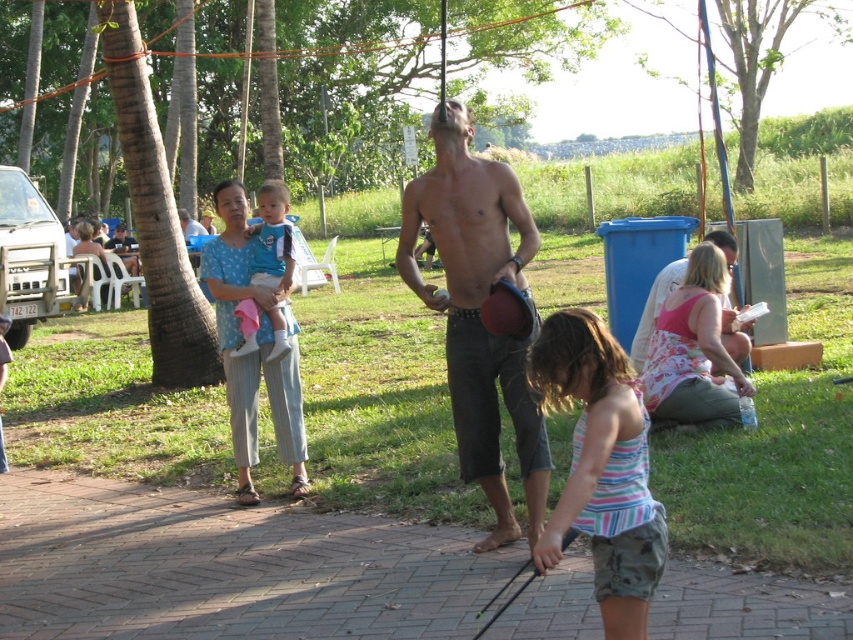
Between striped fabric dress at lower center and blue cotton shirt at center, which one is positioned lower?

striped fabric dress at lower center is below.

Between striped fabric dress at lower center and blue cotton shirt at center, which one has less height?

With less height is blue cotton shirt at center.

Measure the distance between point (x=613, y=349) and camera.

Point (x=613, y=349) and camera are 11.98 feet apart from each other.

You are a GUI agent. You are given a task and a screenshot of the screen. Output one action in this format:
    pyautogui.click(x=<x>, y=<y>)
    Task: Click on the striped fabric dress at lower center
    This screenshot has height=640, width=853.
    Given the screenshot: What is the action you would take?
    pyautogui.click(x=601, y=467)

Find the location of a particular element. This screenshot has height=640, width=853. blue cotton shirt at center is located at coordinates (271, 237).

Can you confirm if blue cotton shirt at center is thinner than blue polka dot dress at center?

Yes, blue cotton shirt at center is thinner than blue polka dot dress at center.

Is point (285, 220) closer to camera compared to point (97, 244)?

Yes.

Where is `blue cotton shirt at center`? The width and height of the screenshot is (853, 640). blue cotton shirt at center is located at coordinates (271, 237).

Is blue cotton shirt at center thinner than shiny metallic helmet at center?

→ Yes.

From the picture: Is blue cotton shirt at center shorter than shiny metallic helmet at center?

Correct, blue cotton shirt at center is not as tall as shiny metallic helmet at center.

Who is more forward, (283, 260) or (650, 337)?

Positioned in front is point (283, 260).

Locate an element on the screen. Image resolution: width=853 pixels, height=640 pixels. blue cotton shirt at center is located at coordinates (271, 237).